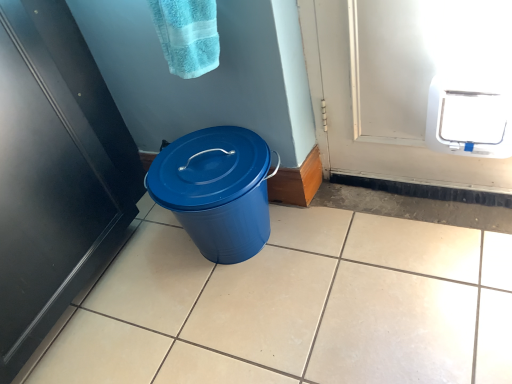
Locate an element on the screen. vacant area situated to the left side of blue plastic trash can at center is located at coordinates (144, 273).